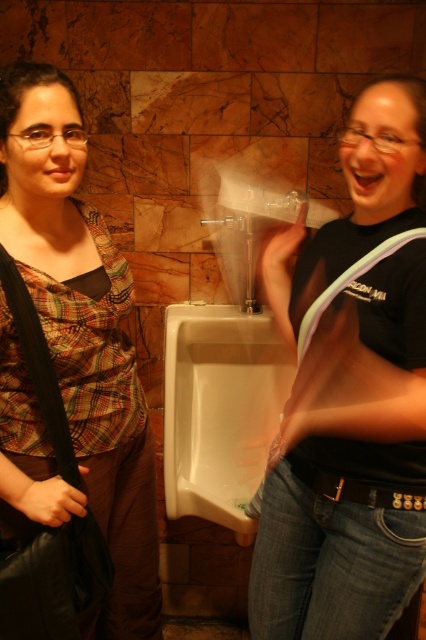
Question: Does plaid fabric shirt at left appear under white glossy urinal at center?

Choices:
 (A) no
 (B) yes

Answer: (A)

Question: Which of the following is the farthest from the observer?

Choices:
 (A) black matte shirt at center
 (B) white glossy urinal at center

Answer: (B)

Question: Can you confirm if plaid fabric shirt at left is positioned to the right of white glossy urinal at center?

Choices:
 (A) no
 (B) yes

Answer: (A)

Question: Among these objects, which one is nearest to the camera?

Choices:
 (A) black matte shirt at center
 (B) plaid fabric shirt at left

Answer: (A)

Question: Among these objects, which one is farthest from the camera?

Choices:
 (A) plaid fabric shirt at left
 (B) white glossy urinal at center

Answer: (B)

Question: Can you confirm if black matte shirt at center is positioned to the right of white glossy urinal at center?

Choices:
 (A) yes
 (B) no

Answer: (A)